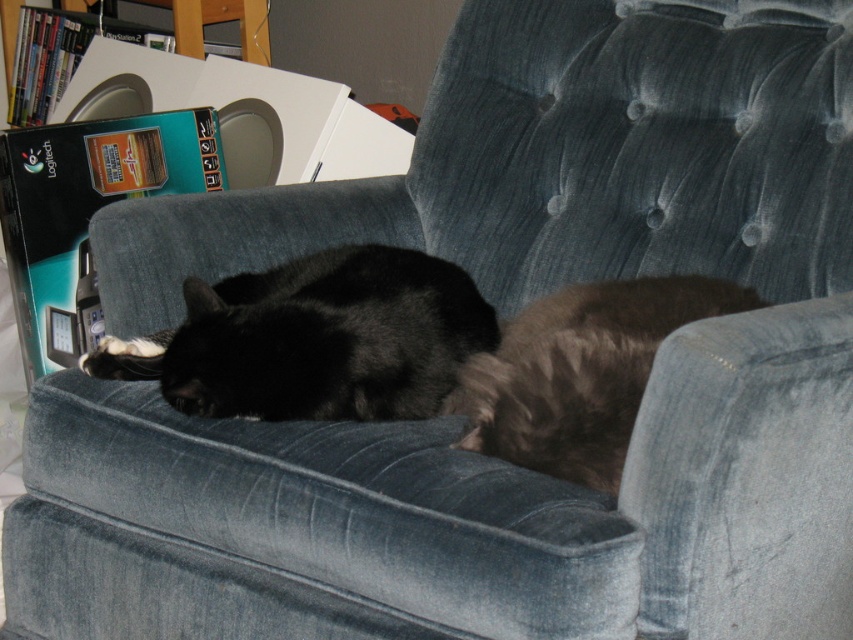
This screenshot has width=853, height=640. What do you see at coordinates (315, 339) in the screenshot?
I see `black fur cat at center` at bounding box center [315, 339].

Which of these two, black fur cat at center or brown fuzzy cat at lower right, stands taller?

With more height is brown fuzzy cat at lower right.

Who is more distant from viewer, (x=119, y=355) or (x=604, y=472)?

The point (x=119, y=355) is behind.

This screenshot has width=853, height=640. I want to click on black fur cat at center, so click(315, 339).